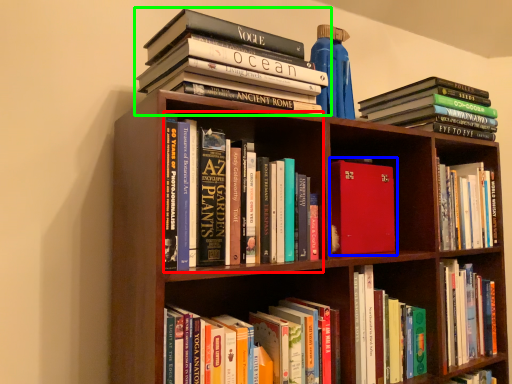
Question: Which is nearer to the book (highlighted by a red box)? book (highlighted by a blue box) or book (highlighted by a green box).

Choices:
 (A) book
 (B) book

Answer: (B)